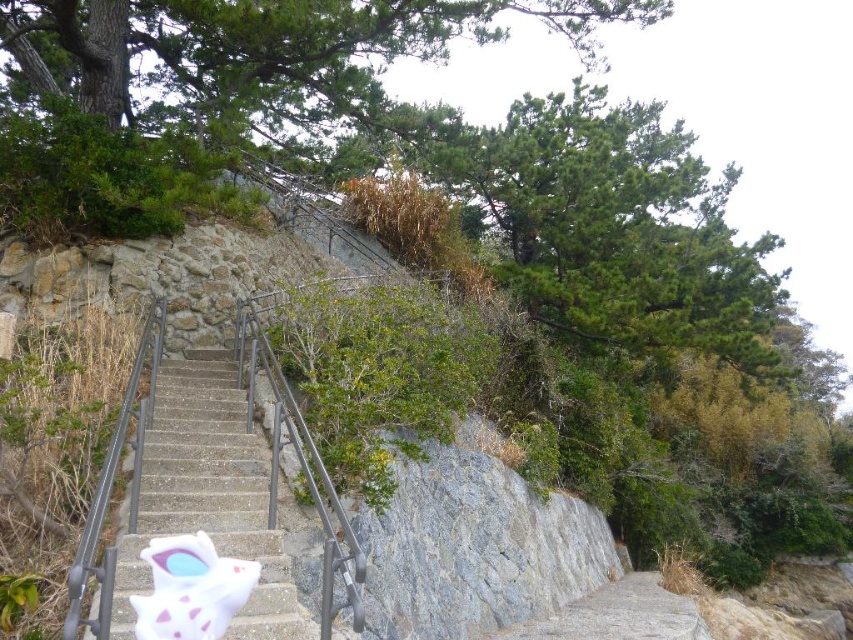
Looking at this image, you are standing at the bottom of the concrete stairs at center and want to reach the green leafy tree at upper center. Which direction should you move in?

You should move upwards towards the green leafy tree at upper center since it is located above the concrete stairs at center.

You are standing at the bottom of the concrete stairs at center and want to reach the green textured tree at upper center. Which direction should you move in to get closer to the tree?

The green textured tree at upper center is bigger than the concrete stairs at center, but to reach it, you should move upwards along the concrete stairs at center since the tree is located at the upper part of the stairs.